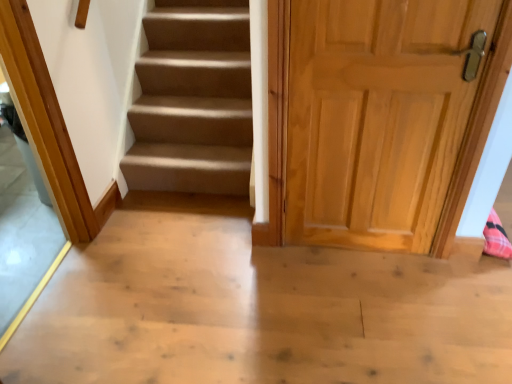
Identify the location of light brown wood door at right. (379, 118).

What do you see at coordinates (379, 118) in the screenshot? The width and height of the screenshot is (512, 384). I see `light brown wood door at right` at bounding box center [379, 118].

Describe the element at coordinates (24, 233) in the screenshot. I see `transparent glass door at left` at that location.

Identify the location of transparent glass door at left. The height and width of the screenshot is (384, 512). (24, 233).

This screenshot has width=512, height=384. In order to click on light brown wood door at right in this screenshot , I will do `click(379, 118)`.

Would you say transparent glass door at left is to the left or to the right of light brown wood door at right in the picture?

In the image, transparent glass door at left appears on the left side of light brown wood door at right.

Which object is closer to the camera, transparent glass door at left or light brown wood door at right?

transparent glass door at left.

Considering the positions of point (44, 274) and point (295, 163), is point (44, 274) closer or farther from the camera than point (295, 163)?

Point (44, 274) appears to be farther away from the viewer than point (295, 163).

From the image's perspective, relative to light brown wood door at right, is transparent glass door at left above or below?

Based on their image positions, transparent glass door at left is located beneath light brown wood door at right.

From a real-world perspective, is transparent glass door at left physically located above or below light brown wood door at right?

transparent glass door at left is situated higher than light brown wood door at right in the real world.

Considering the relative sizes of transparent glass door at left and light brown wood door at right in the image provided, is transparent glass door at left thinner than light brown wood door at right?

In fact, transparent glass door at left might be wider than light brown wood door at right.

Is transparent glass door at left taller or shorter than light brown wood door at right?

In the image, transparent glass door at left appears to be taller than light brown wood door at right.

Considering the relative sizes of transparent glass door at left and light brown wood door at right in the image provided, is transparent glass door at left smaller than light brown wood door at right?

No.

Is light brown wood door at right surrounded by transparent glass door at left?

Actually, light brown wood door at right is outside transparent glass door at left.

Can you see transparent glass door at left touching light brown wood door at right?

No, transparent glass door at left is not next to light brown wood door at right.

Is transparent glass door at left facing away from light brown wood door at right?

transparent glass door at left does not have its back to light brown wood door at right.

Where is `door that appears behind the transparent glass door at left`? Image resolution: width=512 pixels, height=384 pixels. door that appears behind the transparent glass door at left is located at coordinates (379, 118).

Which is more to the left, light brown wood door at right or transparent glass door at left?

transparent glass door at left.

Is light brown wood door at right in front of or behind transparent glass door at left in the image?

In the image, light brown wood door at right appears behind transparent glass door at left.

Which is less distant, (482, 114) or (12, 192)?

The point (482, 114) is closer to the camera.

From the image's perspective, who appears lower, light brown wood door at right or transparent glass door at left?

transparent glass door at left appears lower in the image.

From a real-world perspective, is light brown wood door at right over transparent glass door at left?

No, from a real-world perspective, light brown wood door at right is not above transparent glass door at left.

Which of these two, light brown wood door at right or transparent glass door at left, is thinner?

With smaller width is light brown wood door at right.

Is light brown wood door at right taller than transparent glass door at left?

In fact, light brown wood door at right may be shorter than transparent glass door at left.

Can you confirm if light brown wood door at right is smaller than transparent glass door at left?

Indeed, light brown wood door at right has a smaller size compared to transparent glass door at left.

Do you think light brown wood door at right is within transparent glass door at left, or outside of it?

light brown wood door at right exists outside the volume of transparent glass door at left.

Is light brown wood door at right far from transparent glass door at left?

Absolutely, light brown wood door at right is distant from transparent glass door at left.

Consider the image. Is light brown wood door at right oriented towards transparent glass door at left?

No, light brown wood door at right is not facing towards transparent glass door at left.

Looking at this image, how different are the orientations of light brown wood door at right and transparent glass door at left in degrees?

light brown wood door at right and transparent glass door at left are facing 91.5 degrees away from each other.

How far apart are light brown wood door at right and transparent glass door at left?

5.06 feet.

Find the location of `glass door below the light brown wood door at right (from the image's perspective)`. glass door below the light brown wood door at right (from the image's perspective) is located at coordinates (24, 233).

You are a GUI agent. You are given a task and a screenshot of the screen. Output one action in this format:
    pyautogui.click(x=<x>, y=<y>)
    Task: Click on the door directly beneath the transparent glass door at left (from a real-world perspective)
    Image resolution: width=512 pixels, height=384 pixels.
    Given the screenshot: What is the action you would take?
    pyautogui.click(x=379, y=118)

The image size is (512, 384). There is a light brown wood door at right. What are the coordinates of `glass door above it (from a real-world perspective)` in the screenshot? It's located at (24, 233).